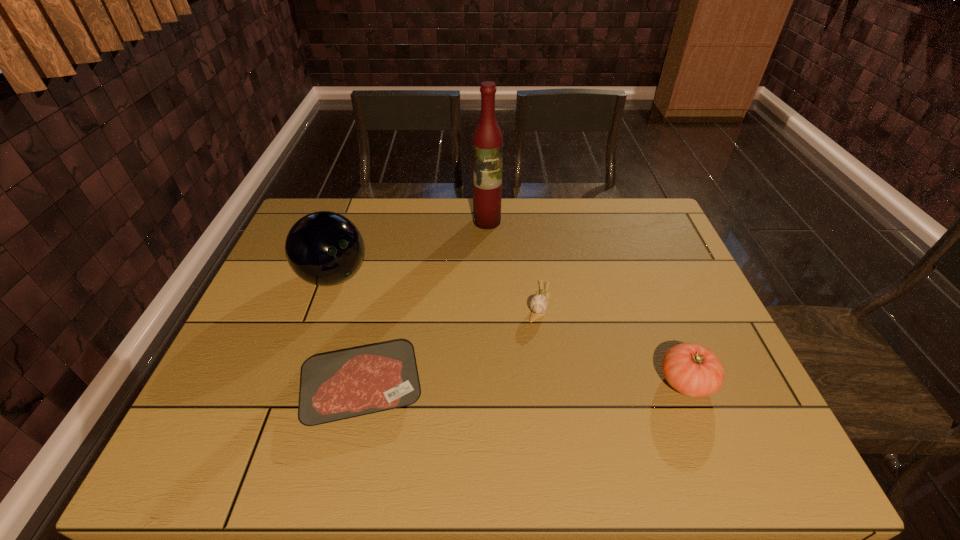
Where is `free space between the tallest object and the shortest object`? free space between the tallest object and the shortest object is located at coordinates (424, 305).

Image resolution: width=960 pixels, height=540 pixels. Find the location of `empty space between the shortest object and the liquor`. empty space between the shortest object and the liquor is located at coordinates (424, 305).

At what (x,y) coordinates should I click in order to perform the action: click on empty location between the rightmost object and the third object from right to left. Please return your answer as a coordinate pair (x, y). The image size is (960, 540). Looking at the image, I should click on (587, 301).

Locate an element on the screen. This screenshot has width=960, height=540. vacant region between the steak and the rightmost object is located at coordinates (524, 384).

Where is `free space between the tomato and the farthest object`? This screenshot has width=960, height=540. free space between the tomato and the farthest object is located at coordinates pyautogui.click(x=587, y=301).

You are a GUI agent. You are given a task and a screenshot of the screen. Output one action in this format:
    pyautogui.click(x=<x>, y=<y>)
    Task: Click on the free space between the second tallest object and the tallest object
    
    Given the screenshot: What is the action you would take?
    pos(410,249)

Identify the location of free space between the steak and the bowling ball. The width and height of the screenshot is (960, 540). (348, 332).

Find the location of a particular element. Image resolution: width=960 pixels, height=540 pixels. free space between the bowling ball and the tomato is located at coordinates (510, 329).

Locate an element on the screen. This screenshot has height=540, width=960. free area in between the steak and the tomato is located at coordinates (524, 384).

Where is `object that stands as the second closest to the rightmost object`? object that stands as the second closest to the rightmost object is located at coordinates (339, 385).